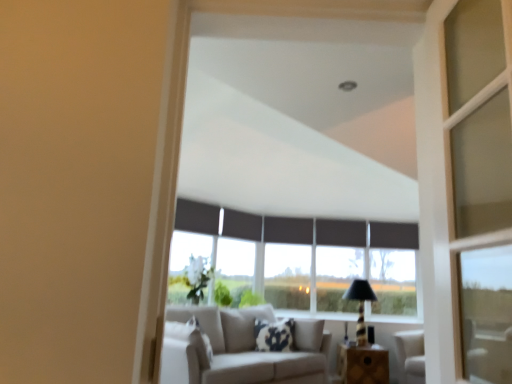
Question: Is black fabric curtain at upper center, which ranks as the 5th curtain in right-to-left order, bigger than black fabric curtain at center, which is the fourth curtain in right-to-left order?

Choices:
 (A) yes
 (B) no

Answer: (A)

Question: Considering the relative sizes of black fabric curtain at upper center, which is counted as the first curtain, starting from the left, and black fabric curtain at center, which appears as the second curtain when viewed from the front, in the image provided, is black fabric curtain at upper center, which is counted as the first curtain, starting from the left, smaller than black fabric curtain at center, which appears as the second curtain when viewed from the front,?

Choices:
 (A) no
 (B) yes

Answer: (A)

Question: Considering the relative sizes of black fabric curtain at upper center, arranged as the fifth curtain when viewed from the back, and black fabric curtain at center, the 4th curtain in the back-to-front sequence, in the image provided, is black fabric curtain at upper center, arranged as the fifth curtain when viewed from the back, shorter than black fabric curtain at center, the 4th curtain in the back-to-front sequence,?

Choices:
 (A) no
 (B) yes

Answer: (A)

Question: From a real-world perspective, is black fabric curtain at upper center, marked as the 1th curtain in a front-to-back arrangement, located beneath black fabric curtain at center, which appears as the second curtain when viewed from the front?

Choices:
 (A) no
 (B) yes

Answer: (B)

Question: Considering the relative sizes of black fabric curtain at upper center, which ranks as the 5th curtain in right-to-left order, and black fabric curtain at center, the 4th curtain in the back-to-front sequence, in the image provided, is black fabric curtain at upper center, which ranks as the 5th curtain in right-to-left order, taller than black fabric curtain at center, the 4th curtain in the back-to-front sequence,?

Choices:
 (A) no
 (B) yes

Answer: (B)

Question: Relative to black fabric curtain at center, the 2th curtain when ordered from left to right, is black fabric curtain at upper center, arranged as the fifth curtain when viewed from the back, in front or behind?

Choices:
 (A) front
 (B) behind

Answer: (A)

Question: Is point (197, 221) closer or farther from the camera than point (248, 213)?

Choices:
 (A) closer
 (B) farther

Answer: (A)

Question: Considering the relative positions of black fabric curtain at upper center, arranged as the fifth curtain when viewed from the back, and black fabric curtain at center, which appears as the second curtain when viewed from the front, in the image provided, is black fabric curtain at upper center, arranged as the fifth curtain when viewed from the back, to the left or to the right of black fabric curtain at center, which appears as the second curtain when viewed from the front,?

Choices:
 (A) right
 (B) left

Answer: (B)

Question: Is black fabric curtain at upper center, arranged as the fifth curtain when viewed from the back, spatially inside black fabric curtain at center, the 4th curtain in the back-to-front sequence, or outside of it?

Choices:
 (A) outside
 (B) inside

Answer: (A)

Question: In the image, is fluffy white pillow at center positioned in front of or behind black textured table lamp at center?

Choices:
 (A) front
 (B) behind

Answer: (A)

Question: Does point (286, 322) appear closer or farther from the camera than point (360, 344)?

Choices:
 (A) closer
 (B) farther

Answer: (B)

Question: Looking at the image, does fluffy white pillow at center seem bigger or smaller compared to black textured table lamp at center?

Choices:
 (A) big
 (B) small

Answer: (B)

Question: From the image's perspective, is fluffy white pillow at center positioned above or below black textured table lamp at center?

Choices:
 (A) below
 (B) above

Answer: (A)

Question: Does point (352, 243) appear closer or farther from the camera than point (348, 355)?

Choices:
 (A) closer
 (B) farther

Answer: (B)

Question: Is black fabric curtain at center, placed as the second curtain when sorted from right to left, bigger or smaller than wooden table at lower center?

Choices:
 (A) big
 (B) small

Answer: (B)